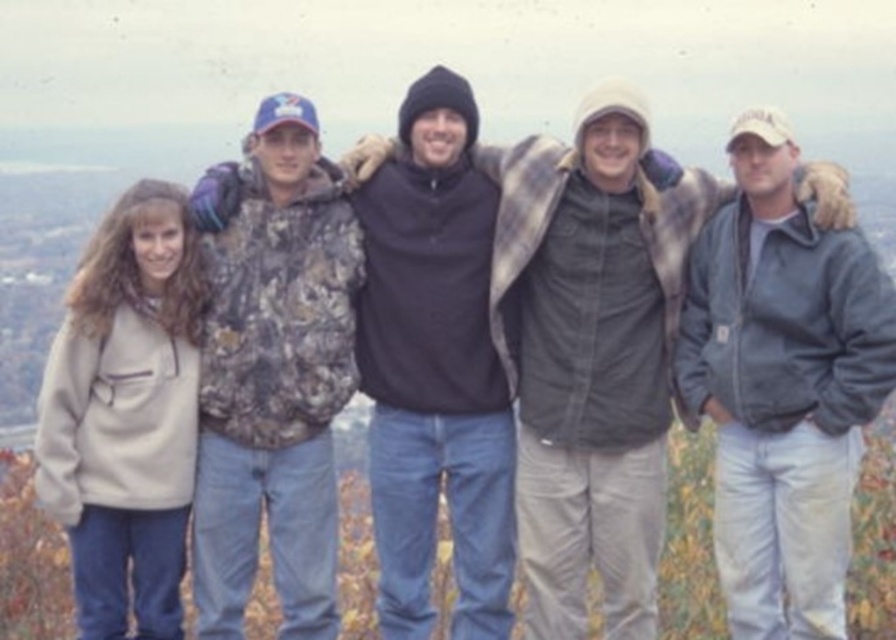
Question: Can you confirm if gray fleece jacket at center is positioned to the left of camo jacket at left?

Choices:
 (A) yes
 (B) no

Answer: (B)

Question: Among these objects, which one is nearest to the camera?

Choices:
 (A) camo jacket at left
 (B) black fleece jacket at center

Answer: (A)

Question: Does gray fleece jacket at center appear over camo jacket at left?

Choices:
 (A) yes
 (B) no

Answer: (A)

Question: Is gray fleece jacket at center to the left of camo jacket at left from the viewer's perspective?

Choices:
 (A) yes
 (B) no

Answer: (B)

Question: Which of the following is the closest to the observer?

Choices:
 (A) gray fleece jacket at center
 (B) camo jacket at left

Answer: (A)

Question: Which of the following is the farthest from the observer?

Choices:
 (A) (797, 611)
 (B) (309, 179)

Answer: (B)